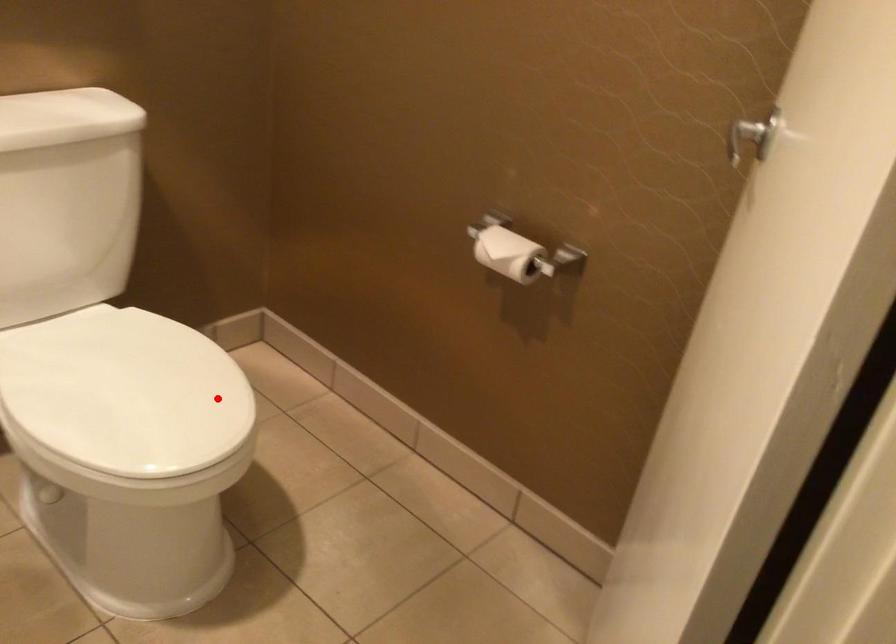
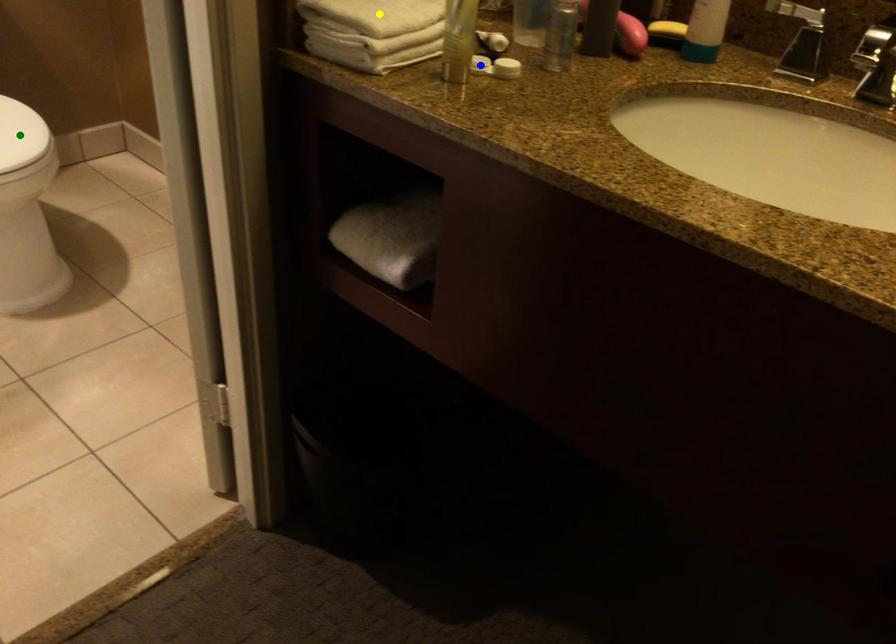
Question: I am providing you with two images of the same scene from different viewpoints. A red point is marked on the first image. You are given multiple points on the second image. Which spot in image 2 lines up with the point in image 1?

Choices:
 (A) blue point
 (B) green point
 (C) yellow point

Answer: (B)